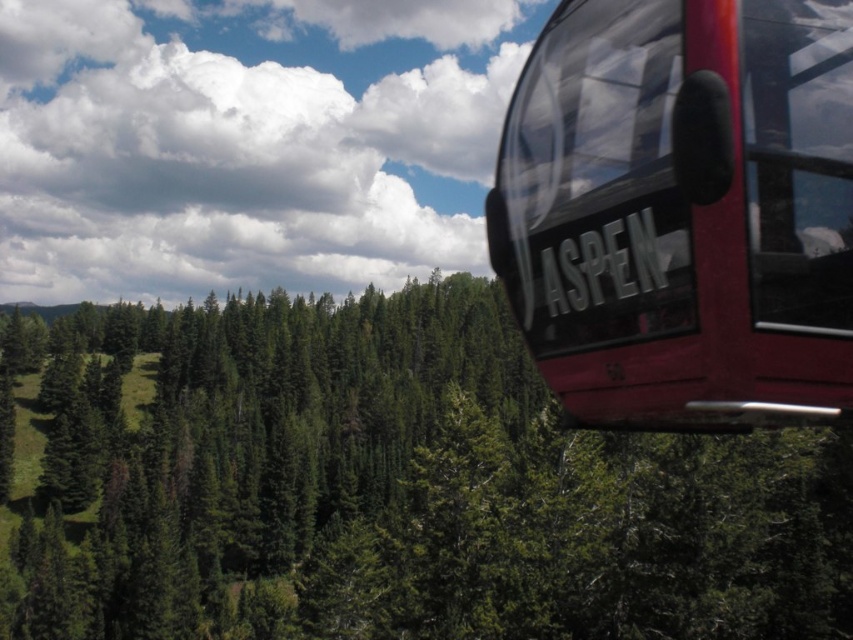
Who is taller, green matte tree at upper center or shiny red cable car at upper right?

With more height is green matte tree at upper center.

Can you confirm if green matte tree at upper center is positioned below shiny red cable car at upper right?

Correct, green matte tree at upper center is located below shiny red cable car at upper right.

Image resolution: width=853 pixels, height=640 pixels. Identify the location of green matte tree at upper center. (384, 486).

Where is `green matte tree at upper center`? The width and height of the screenshot is (853, 640). green matte tree at upper center is located at coordinates (384, 486).